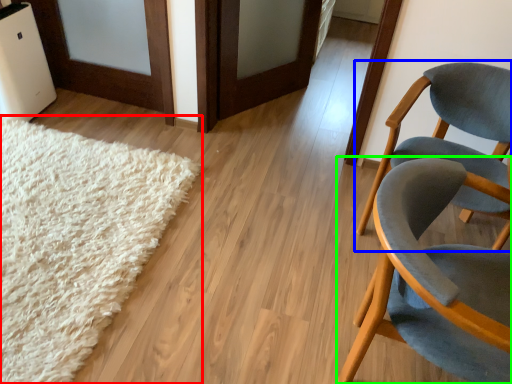
Question: Considering the real-world distances, which object is farthest from mat (highlighted by a red box)? chair (highlighted by a blue box) or chair (highlighted by a green box)?

Choices:
 (A) chair
 (B) chair

Answer: (A)